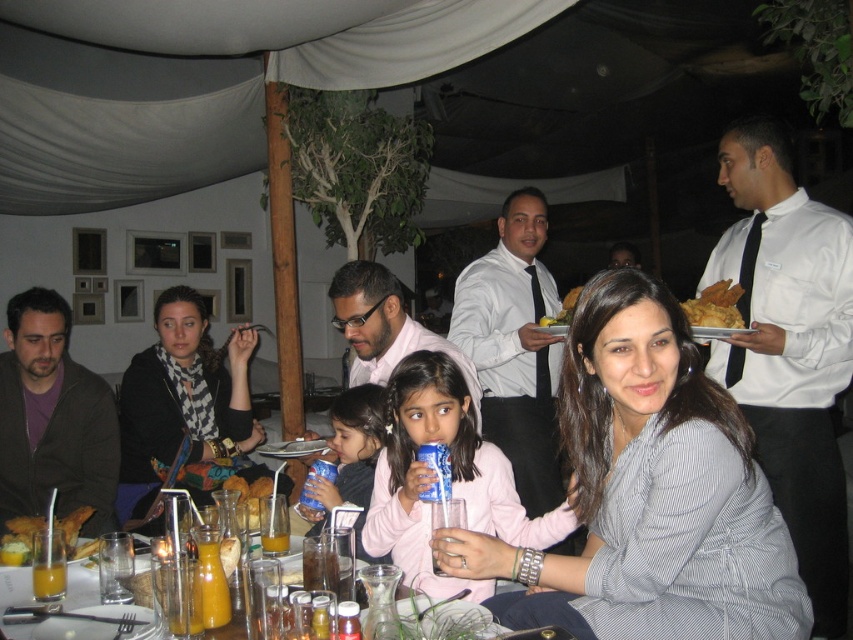
Question: Which point is farther to the camera?

Choices:
 (A) (61, 525)
 (B) (483, 433)
 (C) (283, 541)

Answer: (B)

Question: Is white satin shirt at right in front of golden crispy chicken at lower left?

Choices:
 (A) no
 (B) yes

Answer: (A)

Question: Which of the following is the farthest from the observer?

Choices:
 (A) golden crispy bread at upper center
 (B) black and white scarf at left

Answer: (B)

Question: Is white satin shirt at right in front of white shirt at center?

Choices:
 (A) yes
 (B) no

Answer: (A)

Question: In this image, where is white satin shirt at right located relative to orange juice at lower left?

Choices:
 (A) left
 (B) right

Answer: (B)

Question: Which point is farther to the camera?

Choices:
 (A) golden crispy bread at center
 (B) orange juice at lower left
 (C) translucent glass bottles at center

Answer: (A)